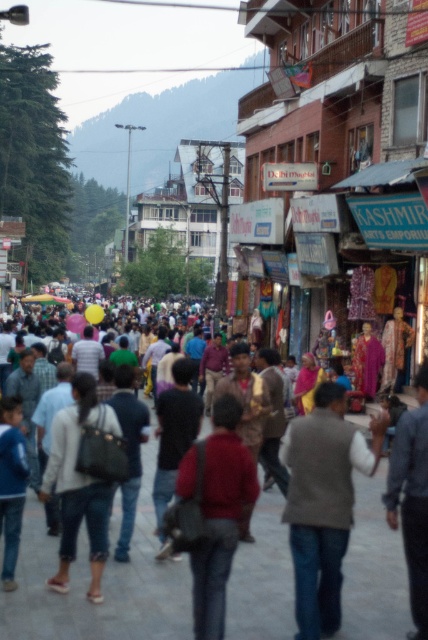
Question: Among these objects, which one is farthest from the camera?

Choices:
 (A) brown woolen vest at center
 (B) multicolored clothing at center

Answer: (B)

Question: Can you confirm if multicolored clothing at center is bigger than brown woolen vest at center?

Choices:
 (A) yes
 (B) no

Answer: (B)

Question: Is multicolored clothing at center closer to camera compared to brown woolen vest at center?

Choices:
 (A) no
 (B) yes

Answer: (A)

Question: Which point is farther from the camera taking this photo?

Choices:
 (A) (83, 529)
 (B) (323, 564)

Answer: (A)

Question: Is the position of multicolored clothing at center less distant than that of brown woolen vest at center?

Choices:
 (A) no
 (B) yes

Answer: (A)